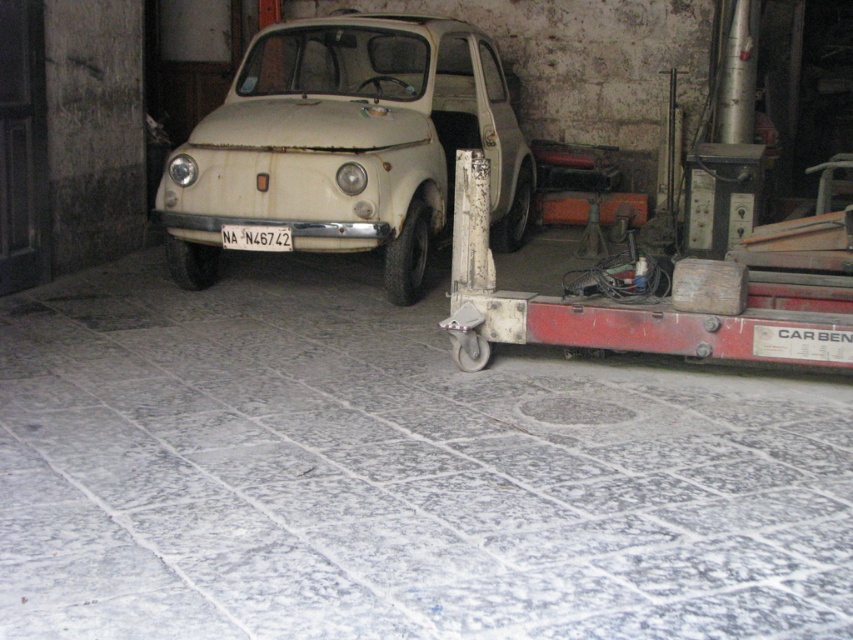
You are a mechanic trying to move a tool from point A to point B in the garage. Point A is at point (219, 200) and point B is at point (242, 234). According to the image, which point is closer to the vintage car?

Point (242, 234) is closer to the vintage car because it is in front of point (219, 200), which is behind it.

Consider the image. You are a mechanic working in the garage and need to access the license plate on the white plastic license plate at center to inspect it. The tools you need are placed on a shelf 1.2 meters away from the white matte car at center. Can you reach the tools without moving from the position where you are inspecting the license plate?

The white matte car at center is 1.10 meters away from the white plastic license plate at center. The tools are 1.2 meters away from the white matte car at center, so the distance between the license plate and the tools is 2.3 meters. Therefore, you cannot reach the tools without moving from the license plate inspection position.